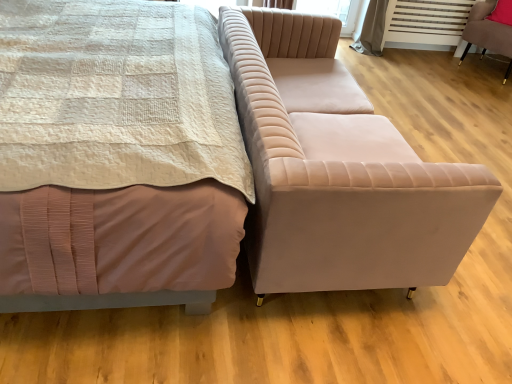
Question: Is matte pink bed at center facing away from pink fabric pillow at upper right?

Choices:
 (A) no
 (B) yes

Answer: (A)

Question: Is matte pink bed at center positioned in front of pink fabric pillow at upper right?

Choices:
 (A) no
 (B) yes

Answer: (B)

Question: Is matte pink bed at center smaller than pink fabric pillow at upper right?

Choices:
 (A) no
 (B) yes

Answer: (A)

Question: Is matte pink bed at center shorter than pink fabric pillow at upper right?

Choices:
 (A) no
 (B) yes

Answer: (A)

Question: Can you confirm if matte pink bed at center is positioned to the left of pink fabric pillow at upper right?

Choices:
 (A) no
 (B) yes

Answer: (B)

Question: Is matte pink bed at center at the right side of pink fabric pillow at upper right?

Choices:
 (A) no
 (B) yes

Answer: (A)

Question: Is matte pink bed at center at the right side of velvet pink chair at right?

Choices:
 (A) no
 (B) yes

Answer: (A)

Question: Could you tell me if matte pink bed at center is turned towards velvet pink chair at right?

Choices:
 (A) no
 (B) yes

Answer: (B)

Question: From the image's perspective, would you say matte pink bed at center is shown under velvet pink chair at right?

Choices:
 (A) no
 (B) yes

Answer: (B)

Question: Is matte pink bed at center outside of velvet pink chair at right?

Choices:
 (A) yes
 (B) no

Answer: (A)

Question: Considering the relative sizes of matte pink bed at center and velvet pink chair at right in the image provided, is matte pink bed at center wider than velvet pink chair at right?

Choices:
 (A) no
 (B) yes

Answer: (B)

Question: From the image's perspective, does matte pink bed at center appear higher than velvet pink chair at right?

Choices:
 (A) no
 (B) yes

Answer: (A)

Question: Would you say velvet beige couch at center is part of matte pink bed at center's contents?

Choices:
 (A) no
 (B) yes

Answer: (A)